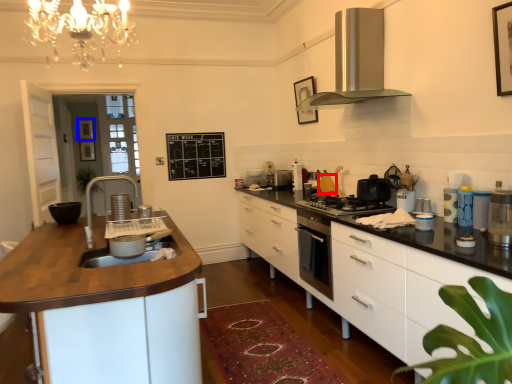
Question: Which point is further to the camera, appliance (highlighted by a red box) or picture frame (highlighted by a blue box)?

Choices:
 (A) appliance
 (B) picture frame

Answer: (B)